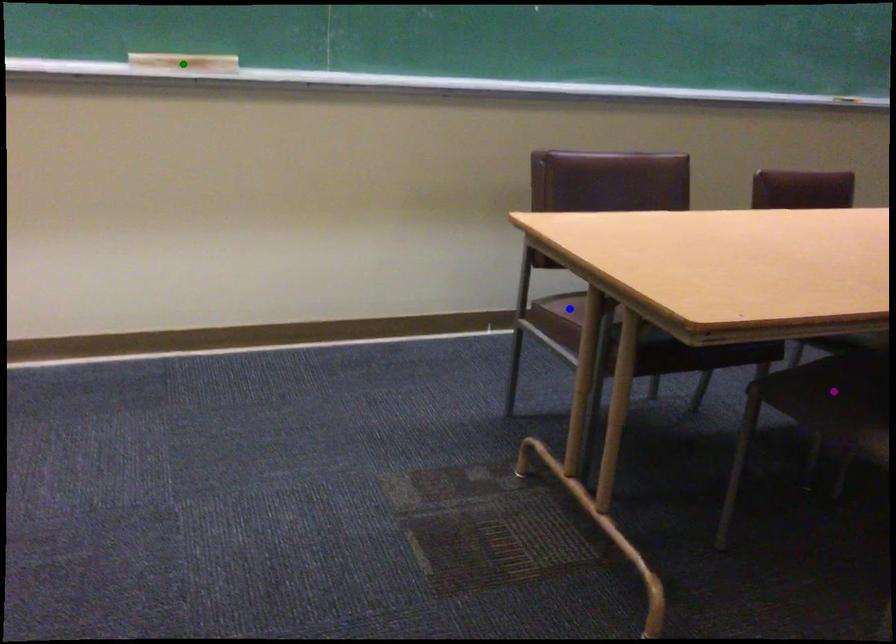
Order these from nearest to farthest:
green point, purple point, blue point

green point → blue point → purple point